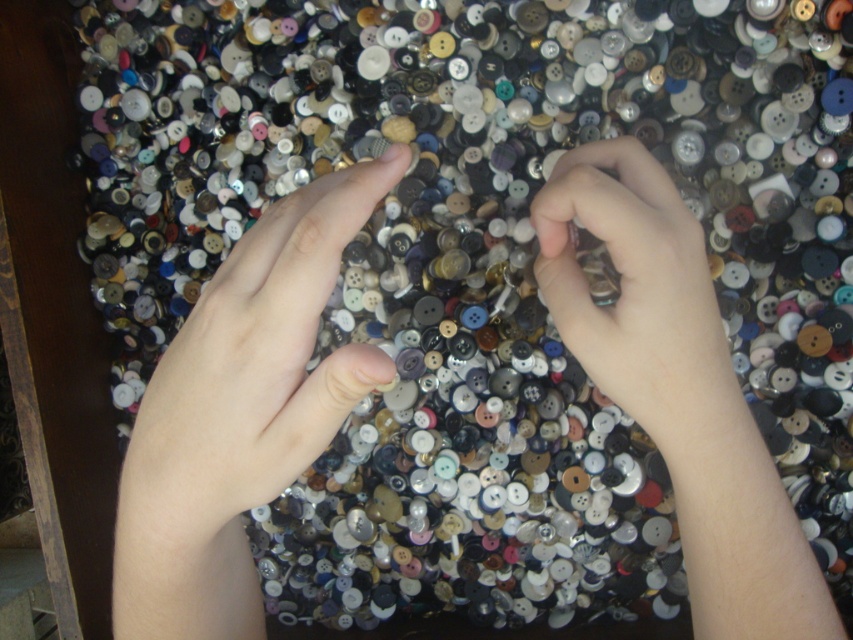
Question: Considering the real-world distances, which object is closest to the smooth skin hands at center?

Choices:
 (A) pale skin at center
 (B) matte plastic button at center

Answer: (A)

Question: Among these objects, which one is farthest from the camera?

Choices:
 (A) matte plastic button at center
 (B) smooth skin hands at center

Answer: (A)

Question: Is pale skin at center positioned behind matte plastic button at center?

Choices:
 (A) no
 (B) yes

Answer: (A)

Question: Which point appears closest to the camera in this image?

Choices:
 (A) (355, 193)
 (B) (606, 378)
 (C) (743, 516)

Answer: (A)

Question: Observing the image, what is the correct spatial positioning of smooth skin hands at center in reference to pale skin at center?

Choices:
 (A) above
 (B) below

Answer: (B)

Question: Can you confirm if smooth skin hands at center is positioned below matte plastic button at center?

Choices:
 (A) no
 (B) yes

Answer: (B)